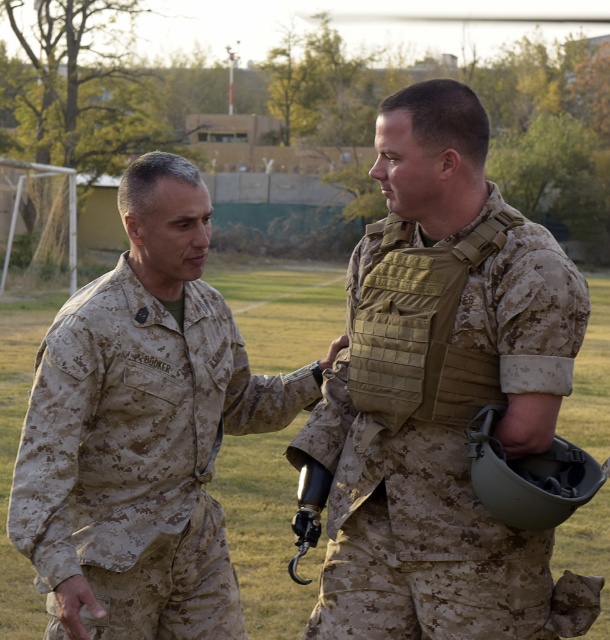
Consider the image. You are a photographer trying to capture a photo of both the camouflage fabric vest at center and the camouflage uniform at left in the same frame. Based on their positions, which object should you focus on first to ensure both are in focus?

The camouflage fabric vest at center is much taller than the camouflage uniform at left, so you should focus on the camouflage fabric vest at center first to ensure both are in focus.

You are a military medic assessing the scene. You notice the camouflage fabric vest at center and the camouflage uniform at left. Which item is covering the other?

The camouflage fabric vest at center is positioned over the camouflage uniform at left, so it is covering the other item.